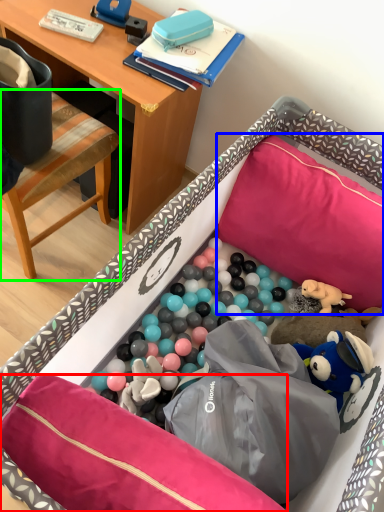
Question: Which object is positioned closest to pillow (highlighted by a red box)? Select from pillow (highlighted by a blue box) and chair (highlighted by a green box).

Choices:
 (A) pillow
 (B) chair

Answer: (A)